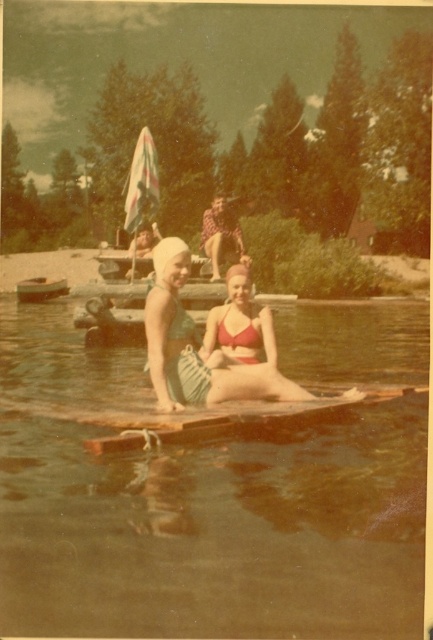
Can you confirm if clear water at center is taller than green striped swimsuit at center?

No.

Is point (44, 595) closer to camera compared to point (160, 355)?

Yes, it is.

Find the location of a particular element. The width and height of the screenshot is (433, 640). clear water at center is located at coordinates (219, 529).

Is clear water at center positioned behind matte green swimsuit at center?

No, clear water at center is closer to the viewer.

Consider the image. Who is more distant from viewer, (352, 333) or (232, 230)?

Point (352, 333)

Image resolution: width=433 pixels, height=640 pixels. What do you see at coordinates (219, 529) in the screenshot? I see `clear water at center` at bounding box center [219, 529].

Locate an element on the screen. clear water at center is located at coordinates (219, 529).

Between point (346, 474) and point (244, 355), which one is positioned in front?

Positioned in front is point (346, 474).

Can you confirm if clear water at center is thinner than matte red bikini at center?

No.

Where is `clear water at center`? This screenshot has width=433, height=640. clear water at center is located at coordinates (219, 529).